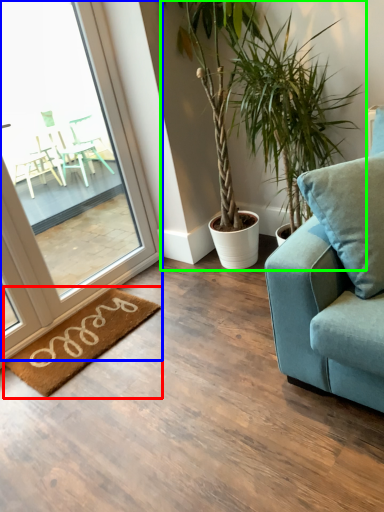
Question: Estimate the real-world distances between objects in this image. Which object is closer to mat (highlighted by a red box), window (highlighted by a blue box) or houseplant (highlighted by a green box)?

Choices:
 (A) window
 (B) houseplant

Answer: (A)